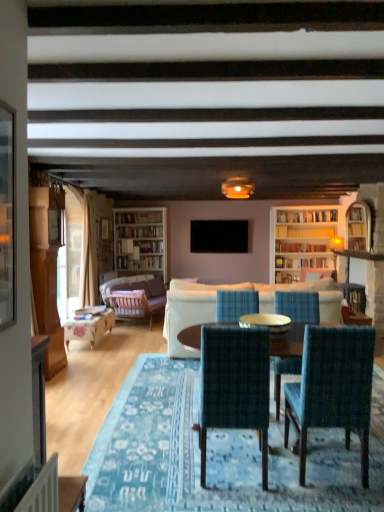
Question: From a real-world perspective, relative to wooden cabinet at left, is clear glass table at center vertically above or below?

Choices:
 (A) above
 (B) below

Answer: (B)

Question: Is point (269, 322) positioned closer to the camera than point (41, 263)?

Choices:
 (A) farther
 (B) closer

Answer: (B)

Question: Considering the real-world distances, which object is closest to the velvet blue armchair at center, which is counted as the 1th armchair, starting from the right?

Choices:
 (A) white fabric couch at center, the second studio couch when ordered from left to right
 (B) wooden cabinet at left
 (C) dark blue woven chair at center, the 3th chair when ordered from back to front
 (D) black matte television at center
 (E) velvet purple sofa at center, which is the second studio couch from right to left

Answer: (D)

Question: Which object is positioned closest to the blue woven chair at center, which is counted as the 3th chair, starting from the front?

Choices:
 (A) wooden armchair at center, the second armchair viewed from the back
 (B) velvet blue armchair at center, which is counted as the 1th armchair, starting from the right
 (C) wooden cabinet at left
 (D) white fabric couch at center, the second studio couch when ordered from left to right
 (E) dark blue woven chair at center, the 3th chair when ordered from back to front

Answer: (D)